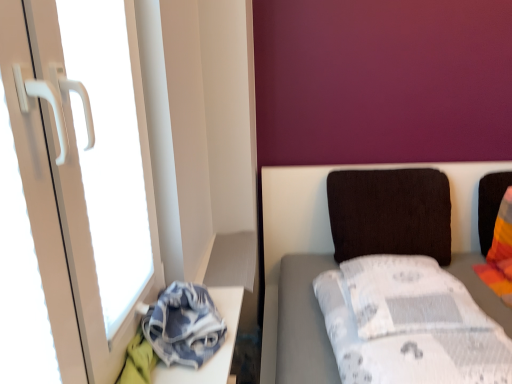
Question: Is point (342, 370) positioned closer to the camera than point (395, 193)?

Choices:
 (A) closer
 (B) farther

Answer: (A)

Question: Considering the relative positions of white fabric bed at right and dark brown fabric pillow at center-right in the image provided, is white fabric bed at right to the left or to the right of dark brown fabric pillow at center-right?

Choices:
 (A) right
 (B) left

Answer: (B)

Question: Estimate the real-world distances between objects in this image. Which object is closer to the denim fabric at lower left?

Choices:
 (A) white fabric bed at right
 (B) white plastic screen door at left
 (C) dark brown fabric pillow at center-right

Answer: (A)

Question: Based on their relative distances, which object is farther from the dark brown fabric pillow at center-right?

Choices:
 (A) white fabric bed at right
 (B) white plastic screen door at left
 (C) denim fabric at lower left

Answer: (B)